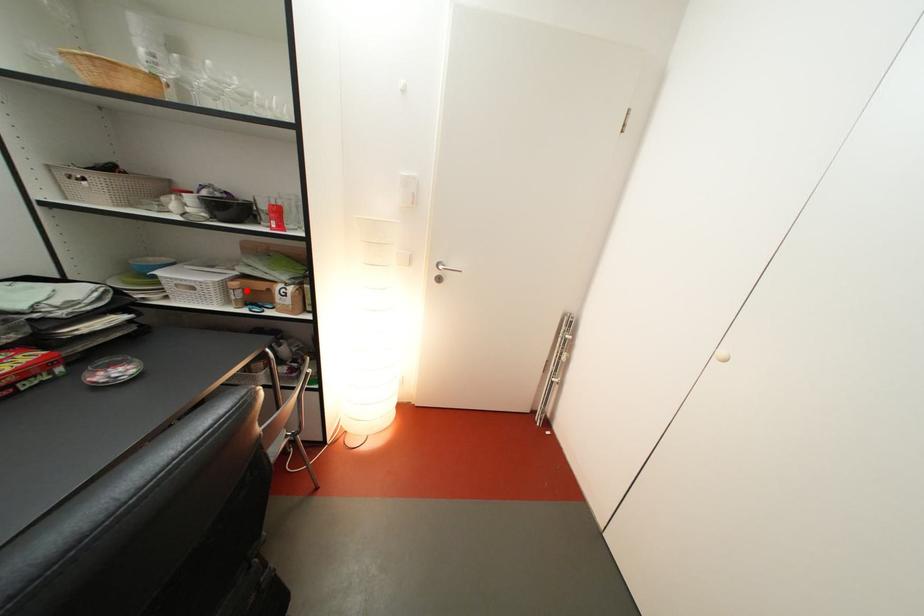
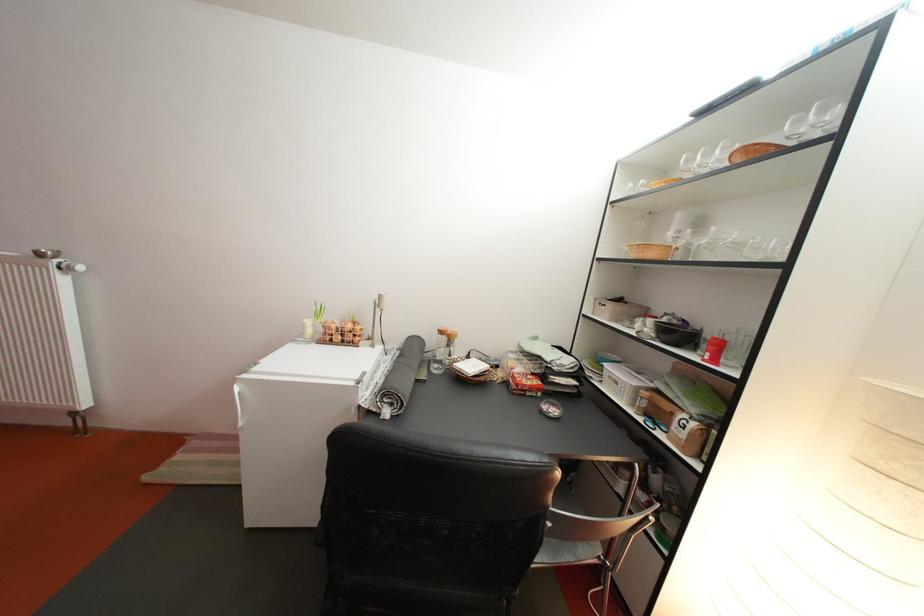
Find the pixel in the second image that matches the highlighted location in the first image.

(658, 400)